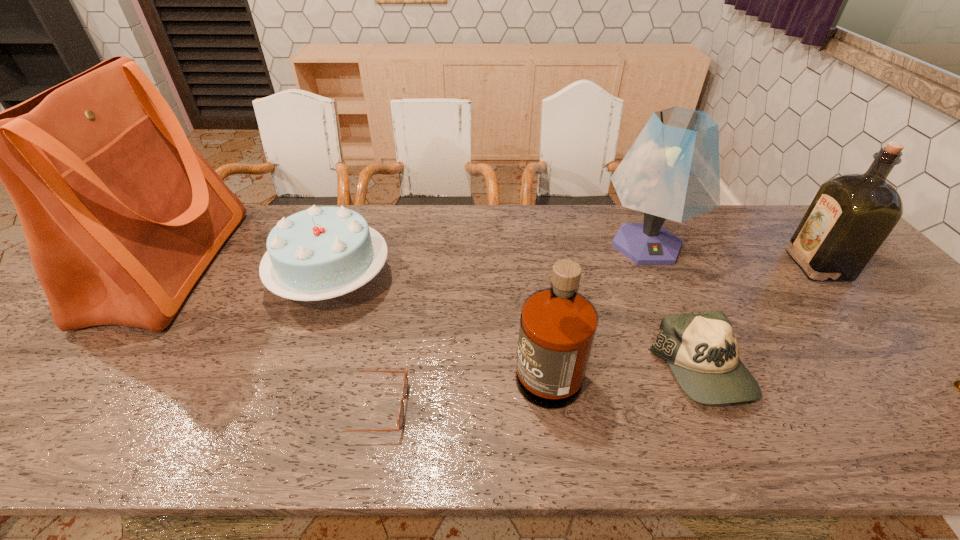
Image resolution: width=960 pixels, height=540 pixels. Identify the location of free space at the near edge of the desktop. (697, 429).

This screenshot has height=540, width=960. I want to click on free space at the right edge, so click(x=862, y=287).

Locate an element on the screen. The width and height of the screenshot is (960, 540). unoccupied area between the tallest object and the birthday cake is located at coordinates (251, 273).

Identify the location of free spot between the nearer liquor and the right liquor. This screenshot has height=540, width=960. (682, 313).

What are the coordinates of `free space that is in between the right liquor and the left liquor` in the screenshot? It's located at (682, 313).

This screenshot has height=540, width=960. Identify the location of free spot between the right liquor and the lampshade. (732, 255).

Locate an element on the screen. This screenshot has width=960, height=540. empty location between the lampshade and the second shortest object is located at coordinates (674, 308).

Locate an element on the screen. The width and height of the screenshot is (960, 540). vacant space in between the nearer liquor and the farther liquor is located at coordinates (682, 313).

Locate an element on the screen. The height and width of the screenshot is (540, 960). free space that is in between the tallest object and the farther liquor is located at coordinates (493, 266).

Where is `unoccupied area between the lampshade and the left liquor`? The width and height of the screenshot is (960, 540). unoccupied area between the lampshade and the left liquor is located at coordinates (596, 302).